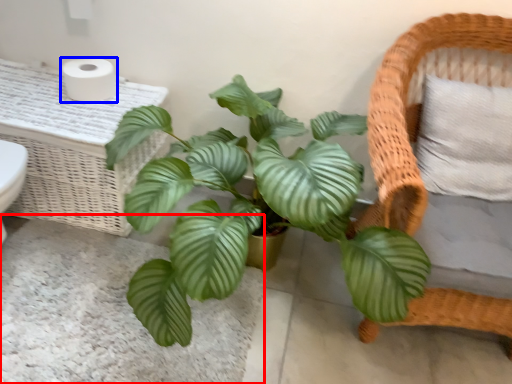
Question: Which object is closer to the camera taking this photo, plain (highlighted by a red box) or toilet paper (highlighted by a blue box)?

Choices:
 (A) plain
 (B) toilet paper

Answer: (A)